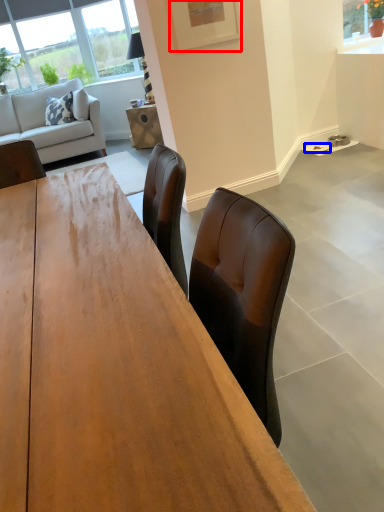
Question: Among these objects, which one is farthest to the camera, picture frame (highlighted by a red box) or plate (highlighted by a blue box)?

Choices:
 (A) picture frame
 (B) plate

Answer: (B)